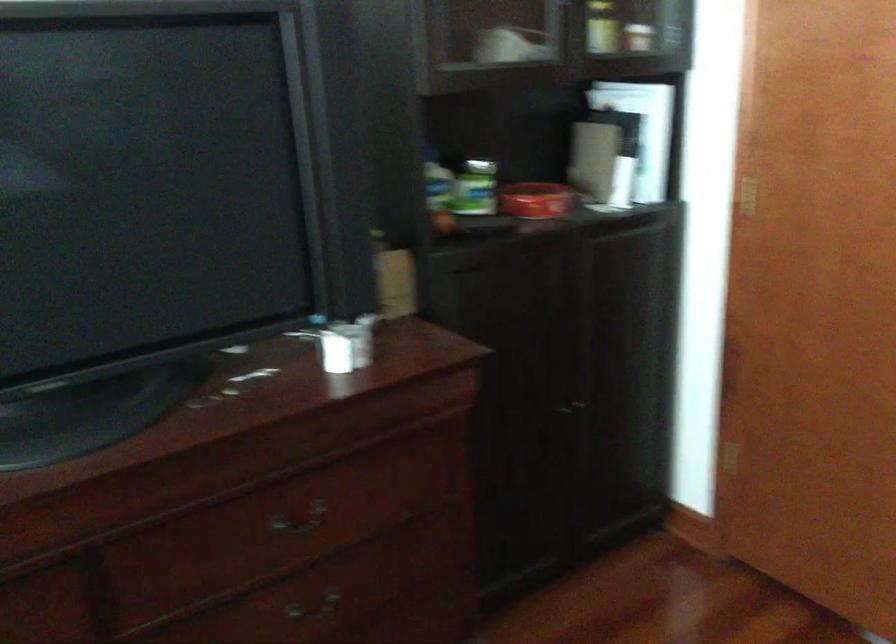
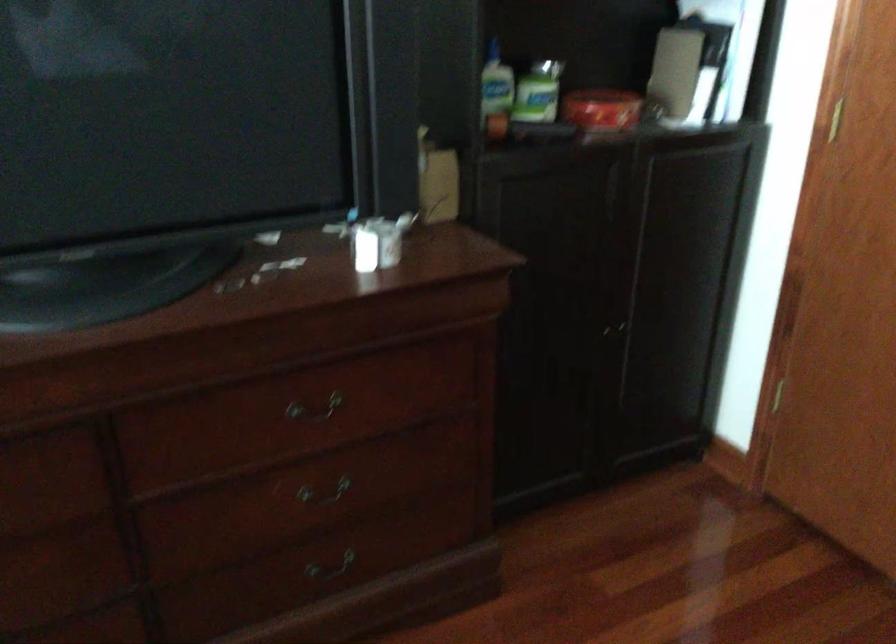
Question: Based on the continuous images, in which direction is the camera rotating? Reply with the corresponding letter.

Choices:
 (A) Left
 (B) Right
 (C) Up
 (D) Down

Answer: (D)